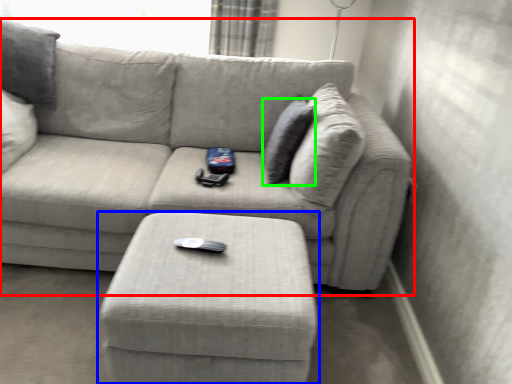
Question: Which is nearer to the studio couch (highlighted by a red box)? table (highlighted by a blue box) or pillow (highlighted by a green box).

Choices:
 (A) table
 (B) pillow

Answer: (B)